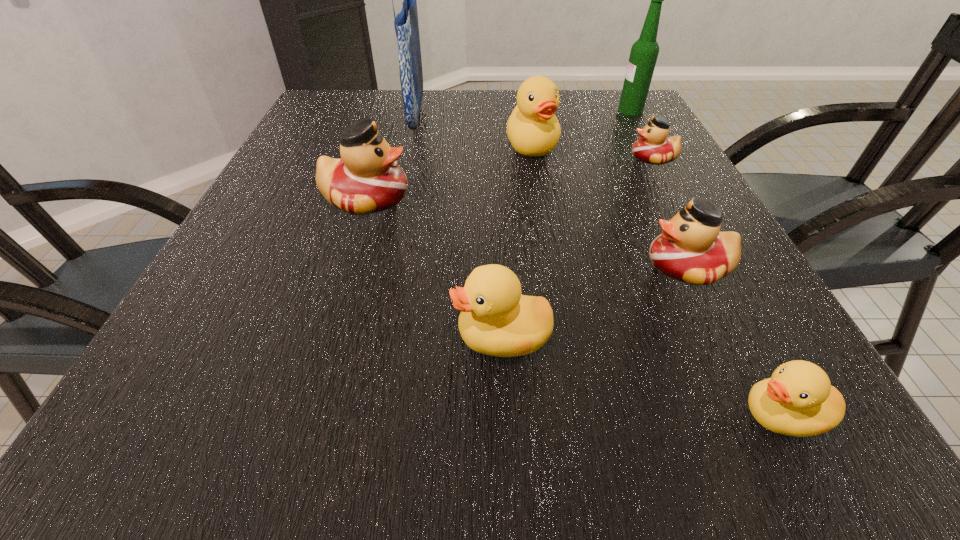
The height and width of the screenshot is (540, 960). In the image, there is a desktop. Find the location of `vacant region at the near edge`. vacant region at the near edge is located at coordinates (655, 446).

In the image, there is a desktop. Where is `vacant space at the left edge`? vacant space at the left edge is located at coordinates (246, 342).

You are a GUI agent. You are given a task and a screenshot of the screen. Output one action in this format:
    pyautogui.click(x=<x>, y=<y>)
    Task: Click on the vacant region at the right edge of the desktop
    The height and width of the screenshot is (540, 960).
    Given the screenshot: What is the action you would take?
    pyautogui.click(x=741, y=275)

Identify the location of free space at the far right corner of the desktop. The width and height of the screenshot is (960, 540). (615, 106).

Locate an element on the screen. The width and height of the screenshot is (960, 540). vacant area that lies between the second biggest yellow duck and the beer bottle is located at coordinates point(566,224).

The image size is (960, 540). I want to click on unoccupied area between the rightmost yellow duck and the biggest yellow duck, so click(x=657, y=280).

Identify the location of free spot between the nearest yellow duck and the smallest red duck. This screenshot has width=960, height=540. (717, 287).

This screenshot has height=540, width=960. In order to click on empty space between the farthest red duck and the fourth nearest duck in this screenshot , I will do `click(510, 178)`.

This screenshot has width=960, height=540. I want to click on free spot between the fourth nearest object and the second nearest duck, so click(x=434, y=267).

Where is `blank region between the leftmost duck and the biggest yellow duck`? blank region between the leftmost duck and the biggest yellow duck is located at coordinates (449, 172).